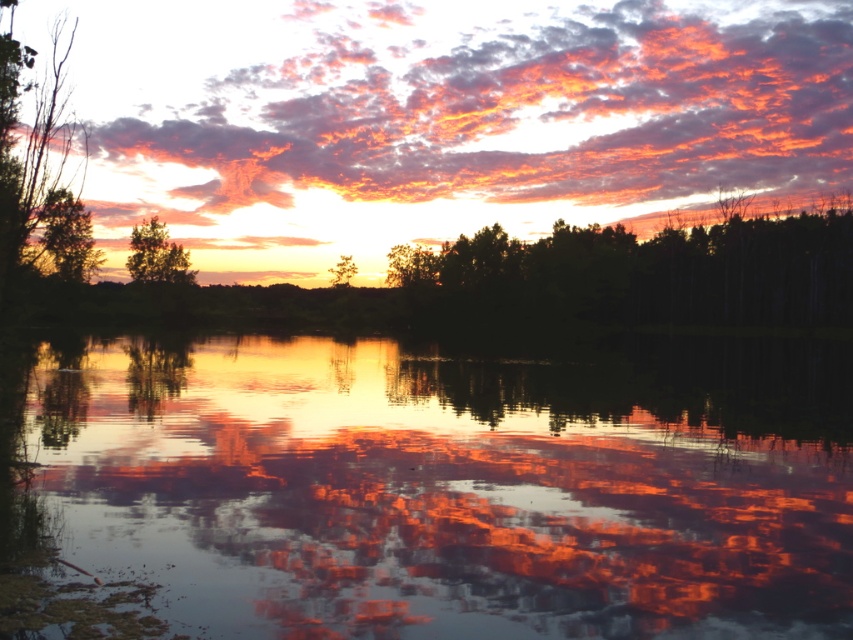
You are an artist setting up your easel to paint the sunset scene. You notice two green matte trees in the image. Which green matte tree is positioned to the right when comparing the green matte tree at left and the green matte tree at upper left?

The green matte tree at left is positioned to the right of the green matte tree at upper left.